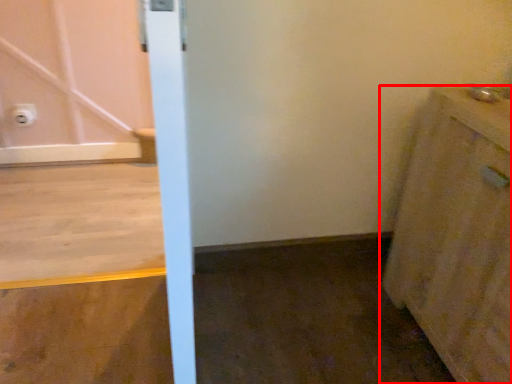
Question: From the image, what is the correct spatial relationship of cabinetry (annotated by the red box) in relation to electric outlet?

Choices:
 (A) left
 (B) right

Answer: (B)